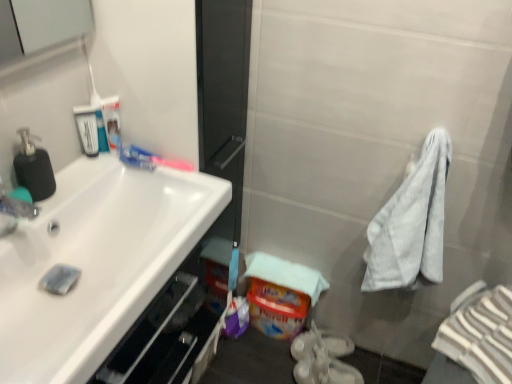
Question: From the image's perspective, is white plastic mouthwash at upper left, acting as the 1th mouthwash starting from the left, positioned above or below clear plastic bottle at upper left, which is the first mouthwash from right to left?

Choices:
 (A) below
 (B) above

Answer: (A)

Question: Is white plastic mouthwash at upper left, marked as the 2th mouthwash in a right-to-left arrangement, spatially inside clear plastic bottle at upper left, marked as the second mouthwash in a left-to-right arrangement, or outside of it?

Choices:
 (A) outside
 (B) inside

Answer: (A)

Question: Which object is the farthest from the white plastic mouthwash at upper left, marked as the 2th mouthwash in a right-to-left arrangement?

Choices:
 (A) matte black soap dispenser at left
 (B) white glossy toothpaste at upper left
 (C) white glossy sink at left
 (D) clear plastic bottle at upper left, which is the first mouthwash from right to left
 (E) white striped bath towel at right

Answer: (E)

Question: Which is farther from the white striped bath towel at right?

Choices:
 (A) matte black soap dispenser at left
 (B) white glossy sink at left
 (C) white plastic mouthwash at upper left, acting as the 1th mouthwash starting from the left
 (D) clear plastic bottle at upper left, marked as the second mouthwash in a left-to-right arrangement
 (E) white glossy toothpaste at upper left

Answer: (A)